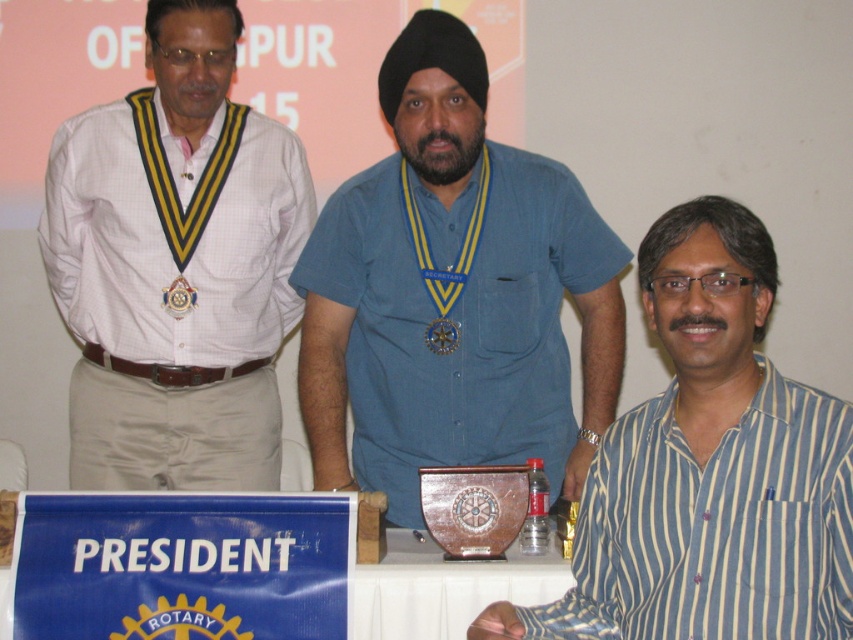
Question: Which point is closer to the camera taking this photo?

Choices:
 (A) (296, 536)
 (B) (172, 291)
 (C) (596, 509)
 (D) (433, 326)

Answer: (C)

Question: Is blue denim shirt at center in front of white checkered shirt at left?

Choices:
 (A) no
 (B) yes

Answer: (B)

Question: Which of these objects is positioned farthest from the white checkered shirt at left?

Choices:
 (A) blue striped shirt at lower right
 (B) gold metallic medallion at center

Answer: (A)

Question: Can you confirm if gold metallic medallion at center is thinner than gold metallic medal at center?

Choices:
 (A) no
 (B) yes

Answer: (B)

Question: Does blue striped shirt at lower right have a greater width compared to gold metallic medallion at center?

Choices:
 (A) yes
 (B) no

Answer: (A)

Question: Estimate the real-world distances between objects in this image. Which object is farther from the white checkered shirt at left?

Choices:
 (A) gold metallic medal at center
 (B) blue denim shirt at center
 (C) white plastic table at lower center
 (D) gold metallic medallion at center

Answer: (A)